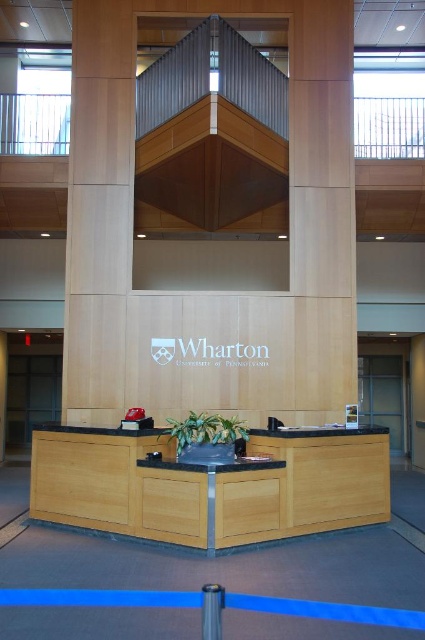
Does light wood/black laminate information desk at center have a lesser width compared to light wood paneling at center?

No.

Who is positioned more to the right, light wood/black laminate information desk at center or light wood paneling at center?

From the viewer's perspective, light wood/black laminate information desk at center appears more on the right side.

Identify the location of light wood/black laminate information desk at center. (210, 484).

Where is `light wood/black laminate information desk at center`? The height and width of the screenshot is (640, 425). light wood/black laminate information desk at center is located at coordinates (210, 484).